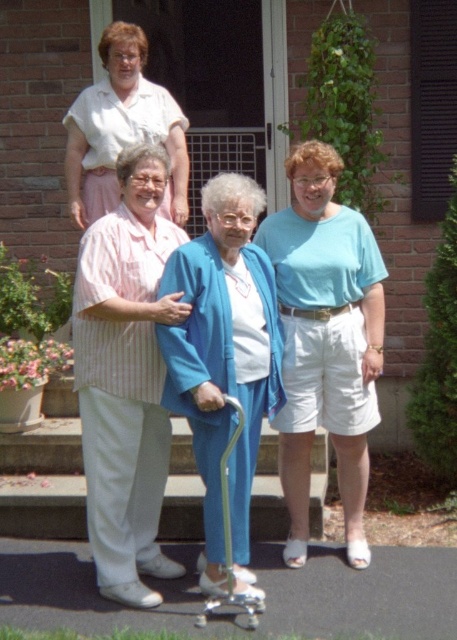
You are a fashion designer observing the scene and want to create a new collection inspired by the clothing items present. Which item has a narrower width between the blue fabric cane at center and the pink fabric blouse at upper left?

The blue fabric cane at center has a lesser width compared to the pink fabric blouse at upper left.